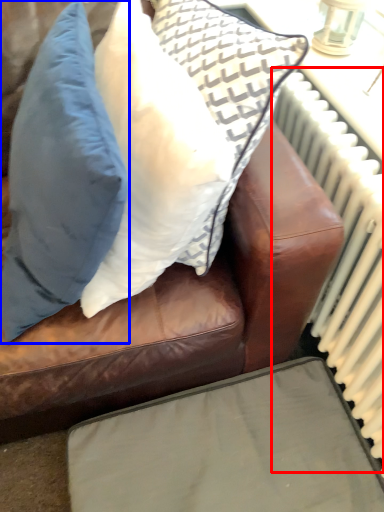
Question: Which of the following is the closest to the observer, radiator (highlighted by a red box) or pillow (highlighted by a blue box)?

Choices:
 (A) radiator
 (B) pillow

Answer: (B)